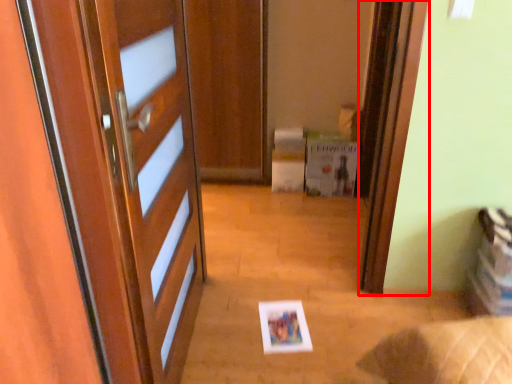
Question: Considering the relative positions of screen door (annotated by the red box) and postcard in the image provided, where is screen door (annotated by the red box) located with respect to the staircase?

Choices:
 (A) left
 (B) right

Answer: (B)